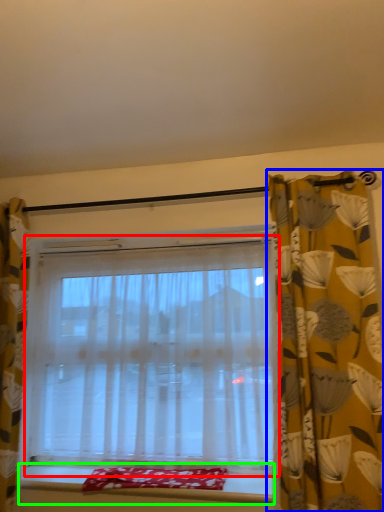
Question: Based on their relative distances, which object is nearer to window (highlighted by a red box)? Choose from curtain (highlighted by a blue box) and window sill (highlighted by a green box).

Choices:
 (A) curtain
 (B) window sill

Answer: (B)